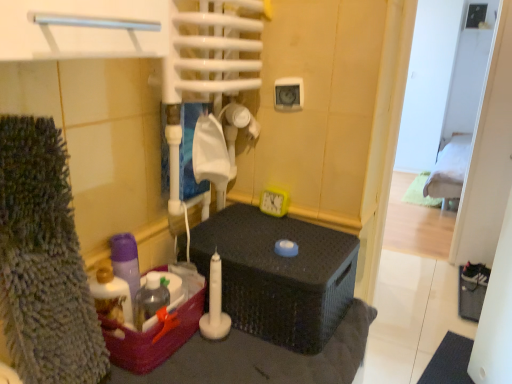
Identify the location of empty space that is in between matte black wicker basket at center and translucent plastic basket at lower left. Image resolution: width=512 pixels, height=384 pixels. (233, 359).